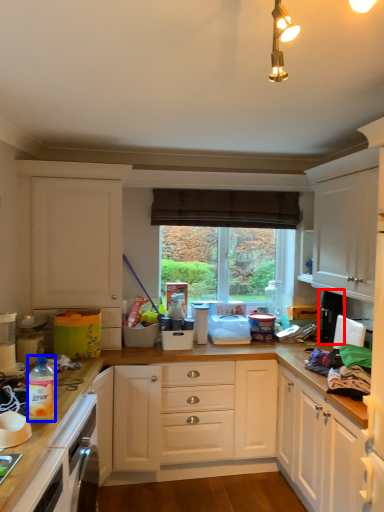
Question: Which object is closer to the camera taking this photo, appliance (highlighted by a red box) or bottle (highlighted by a blue box)?

Choices:
 (A) appliance
 (B) bottle

Answer: (B)